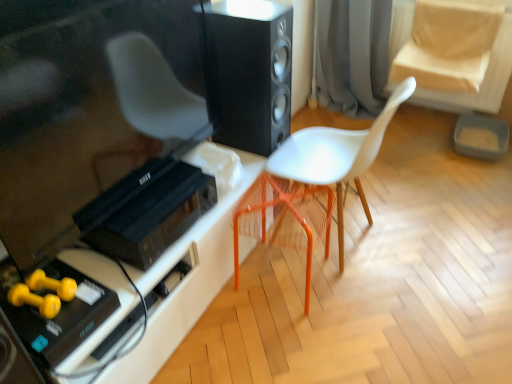
Find the location of a particular element. The image size is (512, 384). free location above black plastic stereo at lower left (from a real-world perspective) is located at coordinates (151, 193).